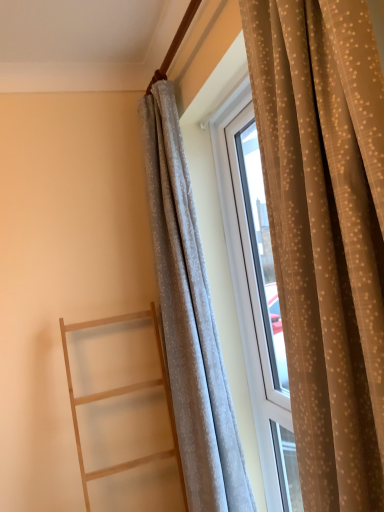
Image resolution: width=384 pixels, height=512 pixels. Describe the element at coordinates (118, 395) in the screenshot. I see `light wood ladder at left` at that location.

What is the approximate width of white sheer curtain at center, the 2th curtain from the front?

white sheer curtain at center, the 2th curtain from the front, is 7.62 inches wide.

Image resolution: width=384 pixels, height=512 pixels. I want to click on light gray sheer curtain at right, positioned as the 1th curtain in front-to-back order, so click(x=326, y=233).

Which object is more forward, light wood ladder at left or light gray sheer curtain at right, positioned as the 1th curtain in front-to-back order?

light gray sheer curtain at right, positioned as the 1th curtain in front-to-back order, is closer to the camera.

Is light wood ladder at left taller or shorter than light gray sheer curtain at right, positioned as the 1th curtain in front-to-back order?

light wood ladder at left is shorter than light gray sheer curtain at right, positioned as the 1th curtain in front-to-back order.

Which object is wider, light wood ladder at left or light gray sheer curtain at right, positioned as the 1th curtain in front-to-back order?

With larger width is light wood ladder at left.

Looking at this image, is light wood ladder at left far from light gray sheer curtain at right, marked as the 2th curtain in a back-to-front arrangement?

Yes.

Is light wood ladder at left wider than white sheer curtain at center, the 2th curtain from the front?

Yes, light wood ladder at left is wider than white sheer curtain at center, the 2th curtain from the front.

Does light wood ladder at left contain white sheer curtain at center, the 2th curtain from the front?

No, white sheer curtain at center, the 2th curtain from the front, is not a part of light wood ladder at left.

Could you tell me if light wood ladder at left is facing white sheer curtain at center, the 2th curtain from the front?

No, light wood ladder at left is not turned towards white sheer curtain at center, the 2th curtain from the front.

How different are the orientations of light wood ladder at left and white sheer curtain at center, positioned as the 1th curtain in back-to-front order, in degrees?

There is a 88-degree angle between the facing directions of light wood ladder at left and white sheer curtain at center, positioned as the 1th curtain in back-to-front order.

I want to click on the 2nd curtain above the light wood ladder at left (from the image's perspective), so coord(326,233).

Can you confirm if light gray sheer curtain at right, positioned as the 1th curtain in front-to-back order, is wider than light wood ladder at left?

No, light gray sheer curtain at right, positioned as the 1th curtain in front-to-back order, is not wider than light wood ladder at left.

Between light gray sheer curtain at right, marked as the 2th curtain in a back-to-front arrangement, and light wood ladder at left, which one has larger size?

With larger size is light gray sheer curtain at right, marked as the 2th curtain in a back-to-front arrangement.

Find the location of a particular element. The image size is (384, 512). ladder on the left of white sheer curtain at center, the 2th curtain from the front is located at coordinates (118, 395).

Can you confirm if white sheer curtain at center, positioned as the 1th curtain in back-to-front order, is thinner than light wood ladder at left?

Yes.

Is point (232, 474) more distant than point (68, 382)?

No, it is not.

Considering the relative sizes of white sheer curtain at center, the 2th curtain from the front, and light wood ladder at left in the image provided, is white sheer curtain at center, the 2th curtain from the front, bigger than light wood ladder at left?

Actually, white sheer curtain at center, the 2th curtain from the front, might be smaller than light wood ladder at left.

From a real-world perspective, between light gray sheer curtain at right, positioned as the 1th curtain in front-to-back order, and white sheer curtain at center, positioned as the 1th curtain in back-to-front order, who is vertically lower?

From a 3D spatial view, white sheer curtain at center, positioned as the 1th curtain in back-to-front order, is below.

This screenshot has height=512, width=384. I want to click on curtain in front of the white sheer curtain at center, positioned as the 1th curtain in back-to-front order, so click(326, 233).

Could you tell me if light gray sheer curtain at right, positioned as the 1th curtain in front-to-back order, is turned towards white sheer curtain at center, positioned as the 1th curtain in back-to-front order?

No.

From the image's perspective, would you say light gray sheer curtain at right, marked as the 2th curtain in a back-to-front arrangement, is positioned over white sheer curtain at center, the 2th curtain from the front?

Yes, from the image's perspective, light gray sheer curtain at right, marked as the 2th curtain in a back-to-front arrangement, is on top of white sheer curtain at center, the 2th curtain from the front.

Which object is more forward, white sheer curtain at center, positioned as the 1th curtain in back-to-front order, or light gray sheer curtain at right, marked as the 2th curtain in a back-to-front arrangement?

light gray sheer curtain at right, marked as the 2th curtain in a back-to-front arrangement, is in front.

Which is more to the right, white sheer curtain at center, the 2th curtain from the front, or light gray sheer curtain at right, marked as the 2th curtain in a back-to-front arrangement?

light gray sheer curtain at right, marked as the 2th curtain in a back-to-front arrangement.

Consider the image. Is white sheer curtain at center, positioned as the 1th curtain in back-to-front order, oriented towards light gray sheer curtain at right, marked as the 2th curtain in a back-to-front arrangement?

No, white sheer curtain at center, positioned as the 1th curtain in back-to-front order, is not aimed at light gray sheer curtain at right, marked as the 2th curtain in a back-to-front arrangement.

Where is `curtain located behind the light gray sheer curtain at right, positioned as the 1th curtain in front-to-back order`? curtain located behind the light gray sheer curtain at right, positioned as the 1th curtain in front-to-back order is located at coordinates (190, 321).

Where is `curtain in front of the light wood ladder at left`? This screenshot has width=384, height=512. curtain in front of the light wood ladder at left is located at coordinates (326, 233).

In order to click on the 1st curtain located above the light wood ladder at left (from a real-world perspective) in this screenshot , I will do `click(190, 321)`.

Estimate the real-world distances between objects in this image. Which object is closer to white sheer curtain at center, positioned as the 1th curtain in back-to-front order, light wood ladder at left or light gray sheer curtain at right, marked as the 2th curtain in a back-to-front arrangement?

light wood ladder at left is positioned closer to the anchor white sheer curtain at center, positioned as the 1th curtain in back-to-front order.

Based on their spatial positions, is light gray sheer curtain at right, positioned as the 1th curtain in front-to-back order, or light wood ladder at left closer to white sheer curtain at center, the 2th curtain from the front?

Based on the image, light wood ladder at left appears to be nearer to white sheer curtain at center, the 2th curtain from the front.

Estimate the real-world distances between objects in this image. Which object is closer to light gray sheer curtain at right, positioned as the 1th curtain in front-to-back order, white sheer curtain at center, the 2th curtain from the front, or light wood ladder at left?

white sheer curtain at center, the 2th curtain from the front, is positioned closer to the anchor light gray sheer curtain at right, positioned as the 1th curtain in front-to-back order.

Which object lies nearer to the anchor point light wood ladder at left, white sheer curtain at center, positioned as the 1th curtain in back-to-front order, or light gray sheer curtain at right, marked as the 2th curtain in a back-to-front arrangement?

The object closer to light wood ladder at left is white sheer curtain at center, positioned as the 1th curtain in back-to-front order.

Which object lies nearer to the anchor point light gray sheer curtain at right, marked as the 2th curtain in a back-to-front arrangement, light wood ladder at left or white sheer curtain at center, the 2th curtain from the front?

white sheer curtain at center, the 2th curtain from the front.

Considering their positions, is light gray sheer curtain at right, marked as the 2th curtain in a back-to-front arrangement, positioned further to light wood ladder at left than white sheer curtain at center, positioned as the 1th curtain in back-to-front order?

light gray sheer curtain at right, marked as the 2th curtain in a back-to-front arrangement, is further to light wood ladder at left.

What are the coordinates of `ladder between light gray sheer curtain at right, marked as the 2th curtain in a back-to-front arrangement, and white sheer curtain at center, positioned as the 1th curtain in back-to-front order, along the z-axis` in the screenshot? It's located at (118, 395).